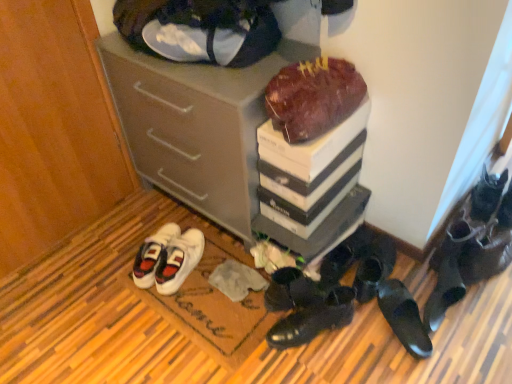
Question: Considering the relative sizes of black leather shoes at lower right, which is the seventh footwear in right-to-left order, and black leather shoes at lower right, the 6th footwear viewed from the right, in the image provided, is black leather shoes at lower right, which is the seventh footwear in right-to-left order, thinner than black leather shoes at lower right, the 6th footwear viewed from the right,?

Choices:
 (A) no
 (B) yes

Answer: (B)

Question: From a real-world perspective, is black leather shoes at lower right, which is the seventh footwear in right-to-left order, located higher than black leather shoes at lower right, the fourth footwear viewed from the left?

Choices:
 (A) no
 (B) yes

Answer: (B)

Question: Is black leather shoes at lower right, which is the seventh footwear in right-to-left order, taller than black leather shoes at lower right, the fourth footwear viewed from the left?

Choices:
 (A) no
 (B) yes

Answer: (B)

Question: Can you confirm if black leather shoes at lower right, placed as the 3th footwear when sorted from left to right, is positioned to the left of black leather shoes at lower right, the 6th footwear viewed from the right?

Choices:
 (A) yes
 (B) no

Answer: (A)

Question: Would you say black leather shoes at lower right, the 6th footwear viewed from the right, is part of black leather shoes at lower right, placed as the 3th footwear when sorted from left to right,'s contents?

Choices:
 (A) no
 (B) yes

Answer: (A)

Question: In the image, is black leather shoes at lower center, placed as the 8th footwear when sorted from right to left, on the left side or the right side of white fabric doormat at lower center?

Choices:
 (A) left
 (B) right

Answer: (B)

Question: From their relative heights in the image, would you say black leather shoes at lower center, acting as the second footwear starting from the left, is taller or shorter than white fabric doormat at lower center?

Choices:
 (A) short
 (B) tall

Answer: (B)

Question: Considering their positions, is black leather shoes at lower center, placed as the 8th footwear when sorted from right to left, located in front of or behind white fabric doormat at lower center?

Choices:
 (A) behind
 (B) front

Answer: (A)

Question: From a real-world perspective, relative to white fabric doormat at lower center, is black leather shoes at lower center, placed as the 8th footwear when sorted from right to left, vertically above or below?

Choices:
 (A) below
 (B) above

Answer: (B)

Question: In terms of width, does white fabric doormat at lower center look wider or thinner when compared to shiny black shoes at lower right, which is the 5th footwear from right to left?

Choices:
 (A) wide
 (B) thin

Answer: (A)

Question: Choose the correct answer: Is white fabric doormat at lower center inside shiny black shoes at lower right, which is the 5th footwear from right to left, or outside it?

Choices:
 (A) inside
 (B) outside

Answer: (B)

Question: Is white fabric doormat at lower center in front of or behind shiny black shoes at lower right, which is the 5th footwear from right to left, in the image?

Choices:
 (A) front
 (B) behind

Answer: (A)

Question: Based on their sizes in the image, would you say white fabric doormat at lower center is bigger or smaller than shiny black shoes at lower right, which is the 5th footwear from right to left?

Choices:
 (A) big
 (B) small

Answer: (A)

Question: Considering the relative positions of black leather shoes at lower right, placed as the 8th footwear when sorted from left to right, and black leather shoe at lower right, acting as the 9th footwear starting from the left, in the image provided, is black leather shoes at lower right, placed as the 8th footwear when sorted from left to right, to the left or to the right of black leather shoe at lower right, acting as the 9th footwear starting from the left,?

Choices:
 (A) right
 (B) left

Answer: (B)

Question: From a real-world perspective, is black leather shoes at lower right, placed as the 8th footwear when sorted from left to right, above or below black leather shoe at lower right, the first footwear from the right?

Choices:
 (A) below
 (B) above

Answer: (A)